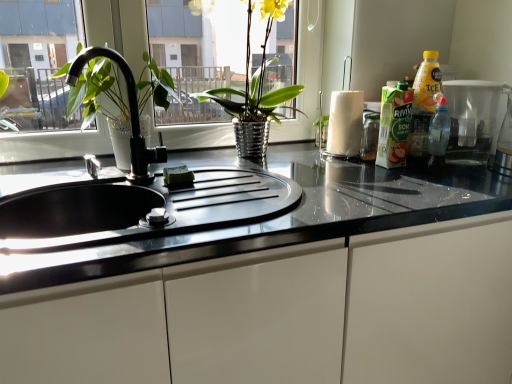
Question: From the image's perspective, does glossy white cabinet at center appear lower than black matte faucet at center?

Choices:
 (A) yes
 (B) no

Answer: (A)

Question: Does glossy white cabinet at center appear on the left side of black matte faucet at center?

Choices:
 (A) yes
 (B) no

Answer: (B)

Question: Is glossy white cabinet at center in front of black matte faucet at center?

Choices:
 (A) no
 (B) yes

Answer: (B)

Question: From a real-world perspective, is glossy white cabinet at center on top of black matte faucet at center?

Choices:
 (A) yes
 (B) no

Answer: (B)

Question: From a real-world perspective, is glossy white cabinet at center located beneath black matte faucet at center?

Choices:
 (A) yes
 (B) no

Answer: (A)

Question: Considering the relative sizes of glossy white cabinet at center and black matte faucet at center in the image provided, is glossy white cabinet at center bigger than black matte faucet at center?

Choices:
 (A) yes
 (B) no

Answer: (A)

Question: Is translucent plastic container at right facing away from shiny metallic vase at center?

Choices:
 (A) yes
 (B) no

Answer: (B)

Question: Is translucent plastic container at right taller than shiny metallic vase at center?

Choices:
 (A) no
 (B) yes

Answer: (A)

Question: Is translucent plastic container at right smaller than shiny metallic vase at center?

Choices:
 (A) no
 (B) yes

Answer: (B)

Question: From a real-world perspective, is translucent plastic container at right below shiny metallic vase at center?

Choices:
 (A) no
 (B) yes

Answer: (B)

Question: From a real-world perspective, is translucent plastic container at right physically above shiny metallic vase at center?

Choices:
 (A) no
 (B) yes

Answer: (A)

Question: Does translucent plastic container at right turn towards shiny metallic vase at center?

Choices:
 (A) no
 (B) yes

Answer: (A)

Question: Is shiny metallic vase at center to the left of translucent plastic container at right from the viewer's perspective?

Choices:
 (A) no
 (B) yes

Answer: (B)